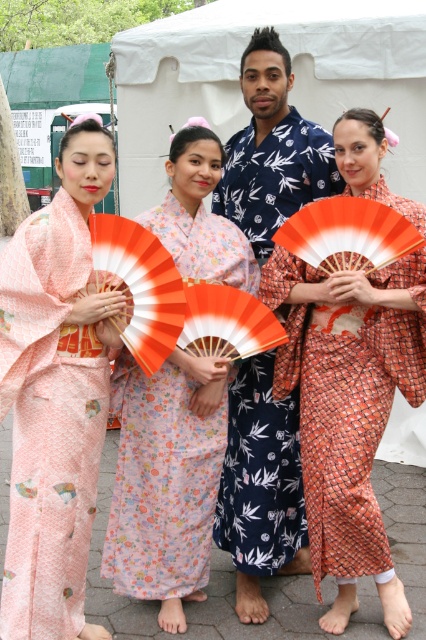
Question: Can you confirm if matte peach kimono at left is positioned to the right of blue printed kimono at center?

Choices:
 (A) yes
 (B) no

Answer: (B)

Question: Does orange patterned kimono at center appear under floral silk kimono at center?

Choices:
 (A) no
 (B) yes

Answer: (A)

Question: Is matte peach kimono at left in front of blue printed kimono at center?

Choices:
 (A) no
 (B) yes

Answer: (B)

Question: Which of the following is the closest to the observer?

Choices:
 (A) matte peach kimono at left
 (B) orange patterned kimono at center
 (C) floral silk kimono at center
 (D) blue printed kimono at center

Answer: (A)

Question: Which object is positioned closest to the floral silk kimono at center?

Choices:
 (A) blue printed kimono at center
 (B) orange patterned kimono at center
 (C) matte peach kimono at left

Answer: (A)

Question: Which point appears farthest from the camera in this image?

Choices:
 (A) (23, 413)
 (B) (184, 218)
 (C) (279, 433)

Answer: (C)